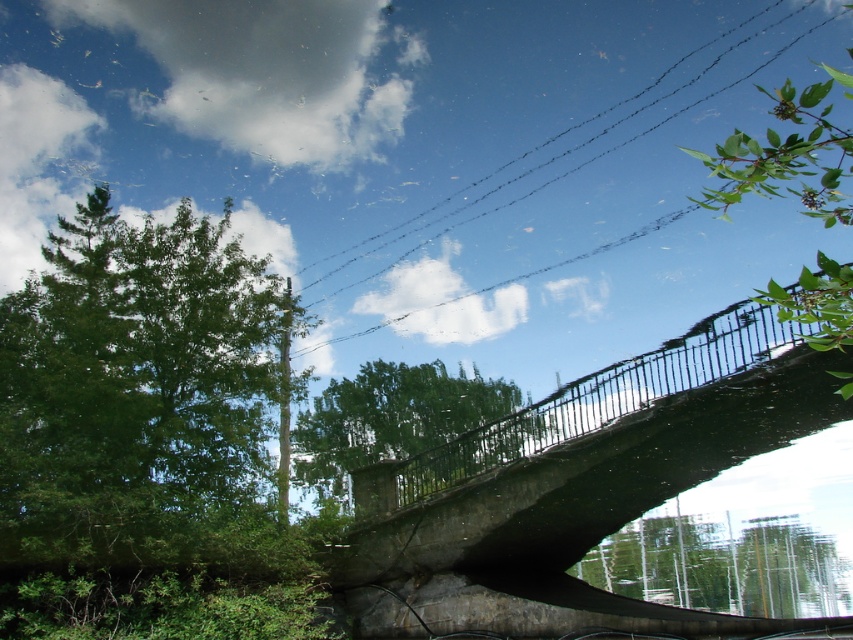
You are standing on the concrete bridge and see the green leafy tree at left and the black wire at upper center. Which object is positioned more to the left side?

The green leafy tree at left is positioned more to the left side than the black wire at upper center.

You are a bird looking for a place to perch. You see the green leafy tree at upper right and the black wire at upper center. Which one is closer to the water below?

The green leafy tree at upper right is positioned under the black wire at upper center, so the green leafy tree at upper right is closer to the water below.